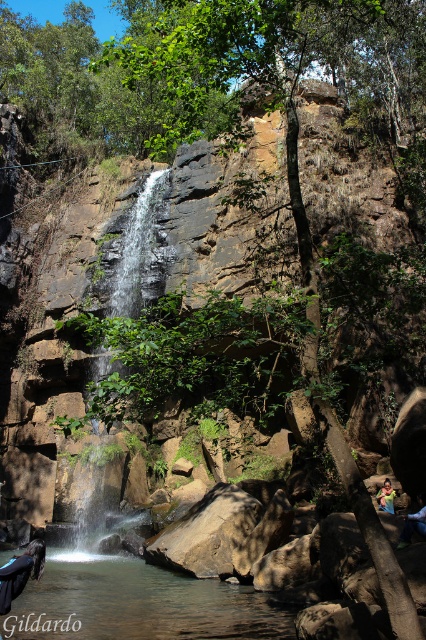
You are standing at the edge of the cliff overlooking the waterfall. You want to locate the clear water at center. Where exactly should you look based on the coordinates provided?

You should look at point (137, 604) to find the clear water at center.

You are standing at the edge of the waterfall and see the dark blue fabric at center and the blue denim shorts at lower right. Which item is closer to you?

The dark blue fabric at center is closer to you because it is in front of the blue denim shorts at lower right.

You are standing at the base of the waterfall and notice a dark blue fabric at center and blue denim shorts at lower right. How far apart are these two items?

The dark blue fabric at center and blue denim shorts at lower right are 20.14 meters apart.